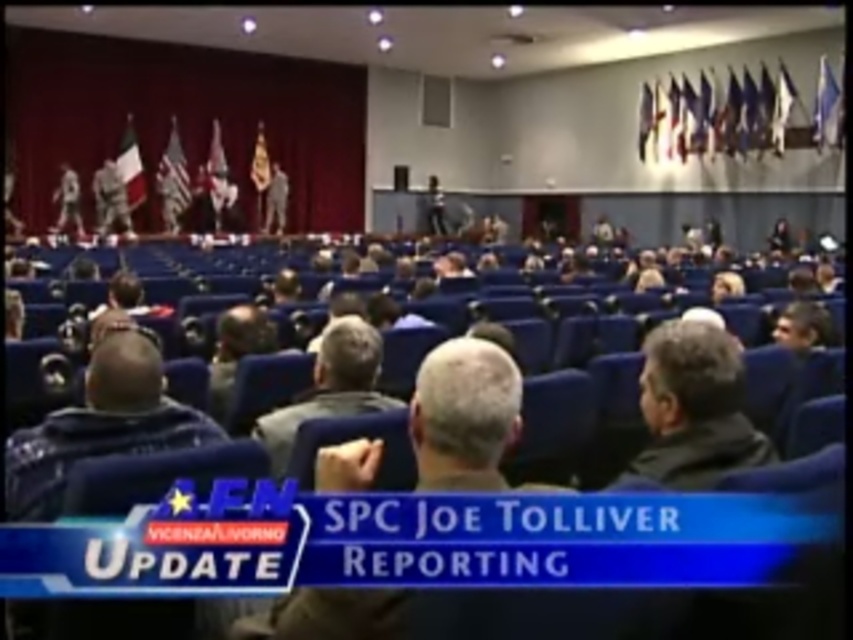
You are an event organizer who needs to arrange seating for two VIP guests. You have two jackets to identify their seats. The jackets are the dark blue jacket at lower left and the gray fabric jacket at center. Which jacket is taller and should be used as a marker for the front row seat?

The dark blue jacket at lower left has a greater height compared to the gray fabric jacket at center, so it should be used as the marker for the front row seat since it is taller.

You are an attendee at this formal event and notice two jackets left on chairs. The dark blue jacket at lower left and the gray fabric jacket at center. Which jacket is closer to the stage?

The dark blue jacket at lower left is positioned on the left side of the gray fabric jacket at center. Since the stage is at the front of the room, the gray fabric jacket at center is closer to the stage than the dark blue jacket at lower left.

You are an event organizer who needs to arrange a coat rack for attendees. You notice two jackets at the center of the stage. Which jacket, the gray matte jacket at center or the gray fabric jacket at center, requires a larger hanger due to its size?

The gray matte jacket at center requires a larger hanger because it is bigger than the gray fabric jacket at center.